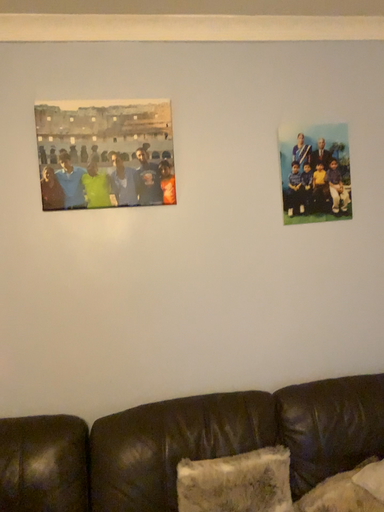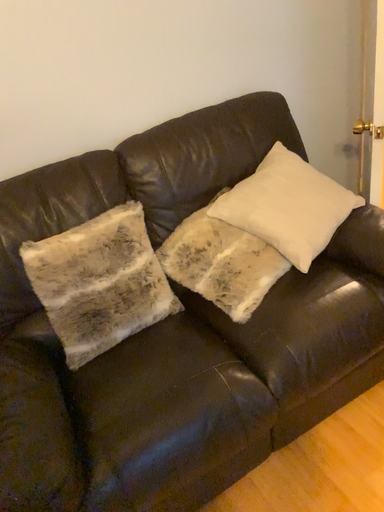
Question: Which way did the camera rotate in the video?

Choices:
 (A) rotated upward
 (B) rotated downward

Answer: (B)